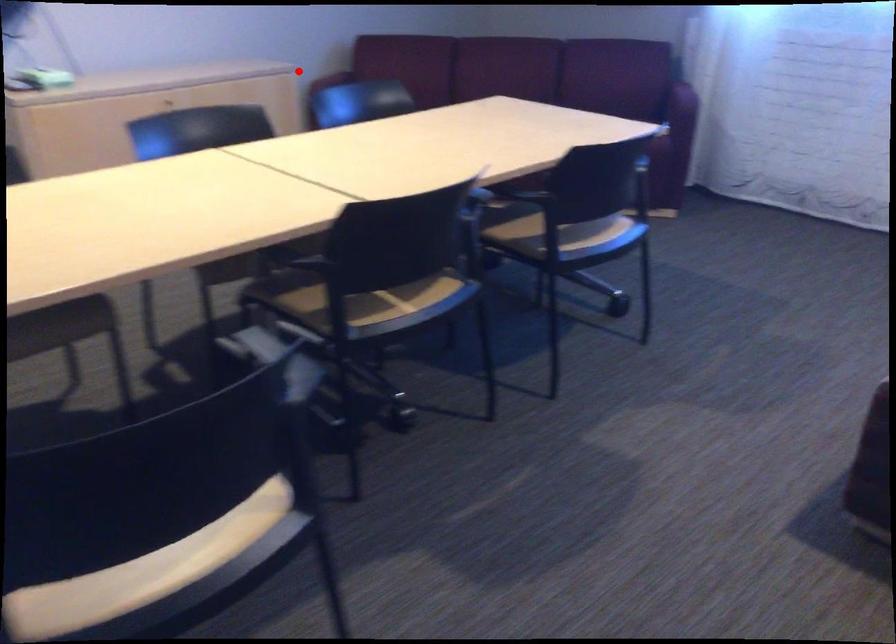
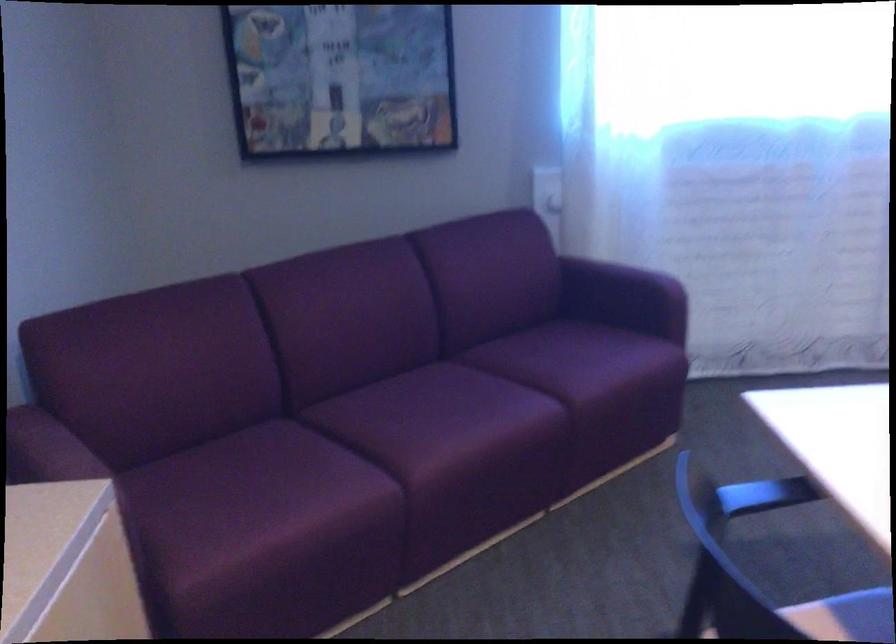
The point at the highlighted location is marked in the first image. Where is the corresponding point in the second image?

(33, 446)